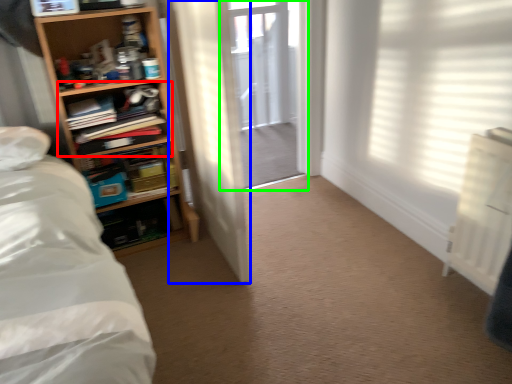
Question: Estimate the real-world distances between objects in this image. Which object is closer to shelf (highlighted by a red box), door (highlighted by a blue box) or screen door (highlighted by a green box)?

Choices:
 (A) door
 (B) screen door

Answer: (A)